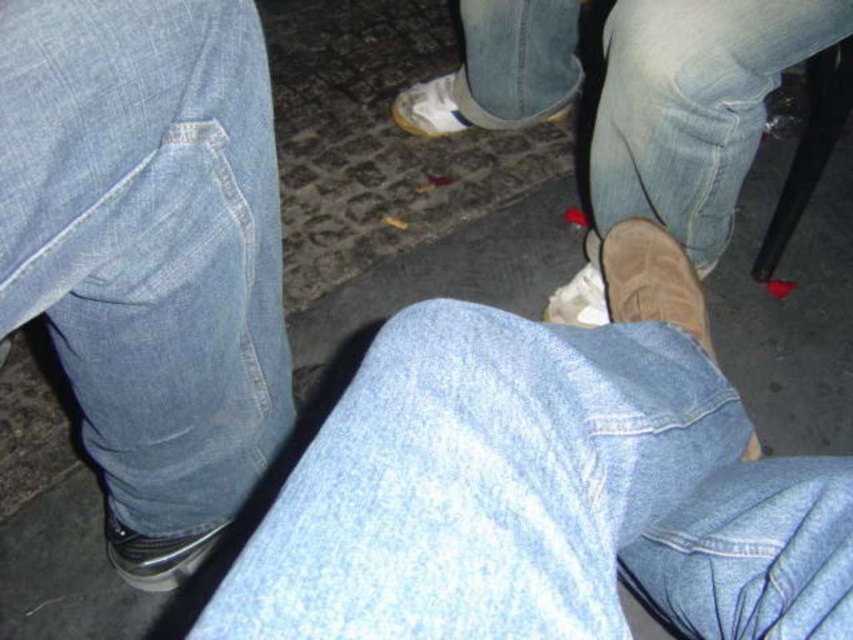
You are a photographer trying to capture a detailed shot of the white suede shoe at center and the denim at lower right. Since you want both subjects to be in focus, you need to adjust your camera settings. Which object should you focus on first to ensure both are sharp?

The denim at lower right is closer to the viewer than the white suede shoe at center. To ensure both are in focus, you should focus on the denim at lower right first, as it is the closer subject. This way, the depth of field will extend from the denim to the shoe, maximizing sharpness for both.

You are a photographer trying to capture a shot of the metallic silver shoe at lower left and the light blue denim jeans at center. Based on their positions, which object should you focus on first if you want to include both in your frame without moving the camera?

The metallic silver shoe at lower left should be focused on first since the light blue denim jeans at center is to the right of it, meaning the shoe is closer to the left edge of the frame. By starting with the shoe, you can ensure both objects fit within the camera frame without needing to reposition.

You are trying to determine which item is taller between the denim at lower right and the white suede shoe at center. Based on the scene, which one is taller?

The denim at lower right is taller than the white suede shoe at center according to the description.